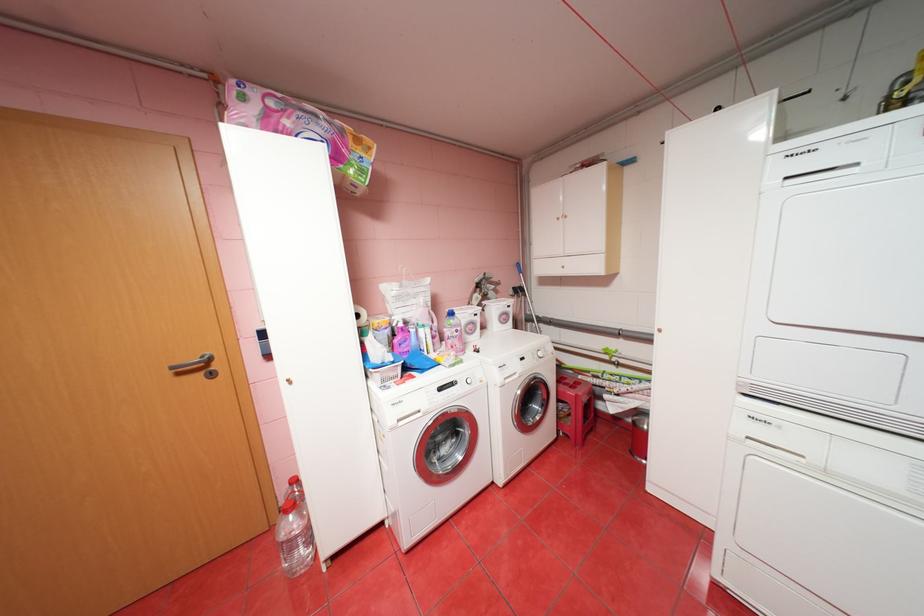
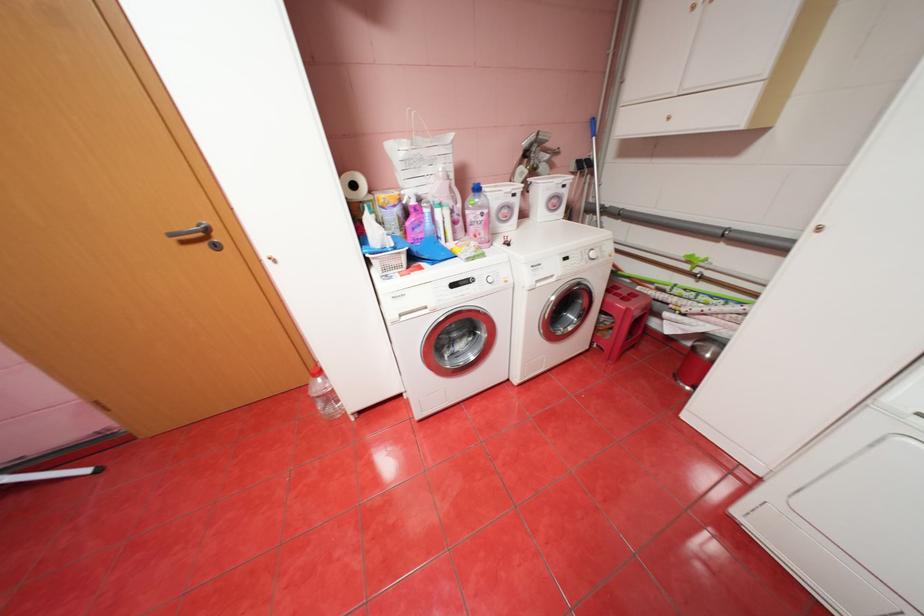
Question: The first image is from the beginning of the video and the second image is from the end. How did the camera likely rotate when shooting the video?

Choices:
 (A) Left
 (B) Right
 (C) Up
 (D) Down

Answer: (D)